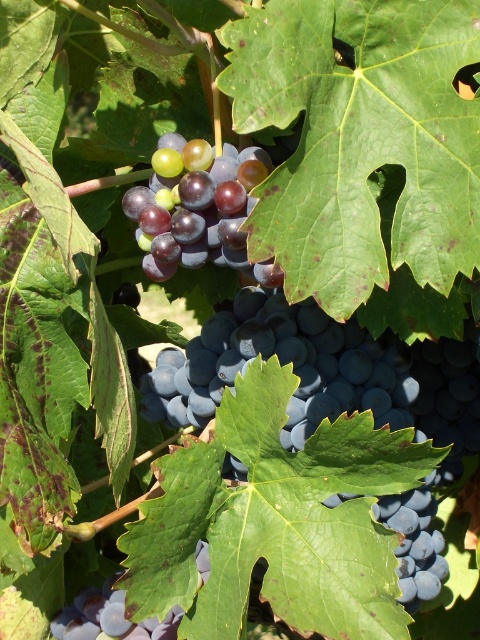
Who is positioned more to the left, shiny dark blue grapes at center or shiny purple grapes at center?

shiny purple grapes at center

Where is `shiny dark blue grapes at center`? shiny dark blue grapes at center is located at coordinates (331, 378).

This screenshot has height=640, width=480. Identify the location of shiny dark blue grapes at center. (331, 378).

Between shiny purple grapes at center and shiny purple grape at center, which one is positioned lower?

Positioned lower is shiny purple grape at center.

How distant is shiny purple grapes at center from shiny purple grape at center?

shiny purple grapes at center and shiny purple grape at center are 58.18 centimeters apart.

Locate an element on the screen. Image resolution: width=480 pixels, height=640 pixels. shiny purple grapes at center is located at coordinates (195, 205).

Where is `shiny purple grapes at center`? The width and height of the screenshot is (480, 640). shiny purple grapes at center is located at coordinates (195, 205).

Does shiny dark blue grapes at center come behind shiny purple grape at center?

Yes, it is behind shiny purple grape at center.

How much distance is there between shiny dark blue grapes at center and shiny purple grape at center?

shiny dark blue grapes at center is 15.83 inches from shiny purple grape at center.

Find the location of a particular element. shiny dark blue grapes at center is located at coordinates (331, 378).